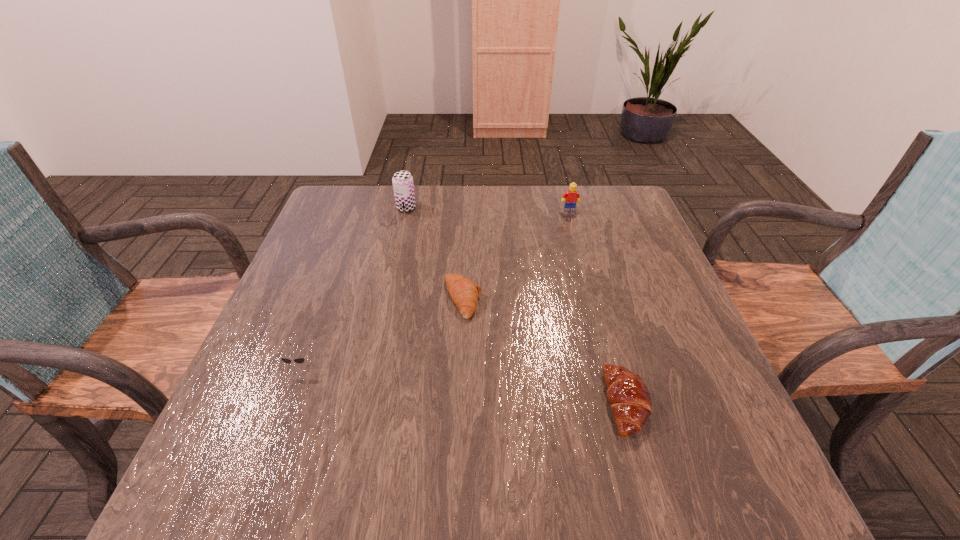
At what (x,y) coordinates should I click in order to perform the action: click on vacant position located 0.070m on the left of the nearer crescent roll. Please return your answer as a coordinate pair (x, y). Looking at the image, I should click on (567, 403).

This screenshot has height=540, width=960. Find the location of `free space located on the back of the shortest object`. free space located on the back of the shortest object is located at coordinates (467, 202).

You are a GUI agent. You are given a task and a screenshot of the screen. Output one action in this format:
    pyautogui.click(x=<x>, y=<y>)
    Task: Click on the beer can that is at the far edge
    The image size is (960, 540).
    Given the screenshot: What is the action you would take?
    pyautogui.click(x=403, y=186)

Where is `Lego that is at the far edge`? Lego that is at the far edge is located at coordinates (572, 196).

Locate an element on the screen. object located at the left edge is located at coordinates (298, 360).

At what (x,y) coordinates should I click in order to perform the action: click on object that is at the right edge. Please return your answer as a coordinate pair (x, y). This screenshot has height=540, width=960. Looking at the image, I should click on (628, 395).

Where is `free region at the far edge of the desktop`? The width and height of the screenshot is (960, 540). free region at the far edge of the desktop is located at coordinates (518, 200).

This screenshot has height=540, width=960. What are the coordinates of `vacant space at the near edge` in the screenshot? It's located at [x=373, y=476].

Identify the location of free space at the left edge of the desktop. (227, 409).

In the image, there is a desktop. Where is `vacant space at the right edge`? The image size is (960, 540). vacant space at the right edge is located at coordinates (632, 248).